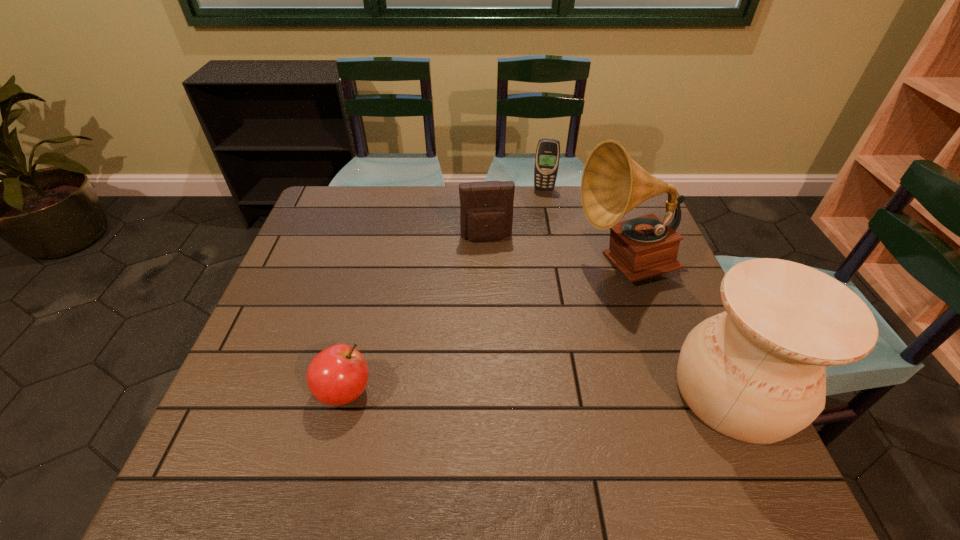
This screenshot has height=540, width=960. Identify the location of vacant space located with an open flap on the second object from left to right. (503, 332).

What are the coordinates of `vacant space situated on the horn of the phonograph record` in the screenshot? It's located at (562, 313).

This screenshot has height=540, width=960. In order to click on vacant space located on the horn of the phonograph record in this screenshot , I will do `click(528, 343)`.

This screenshot has width=960, height=540. I want to click on vacant space located on the horn of the phonograph record, so click(571, 305).

In order to click on vacant space located 0.260m on the screen of the cellular telephone in this screenshot , I will do `click(536, 240)`.

This screenshot has height=540, width=960. In order to click on vacant space located 0.210m on the screen of the cellular telephone in this screenshot , I will do `click(538, 230)`.

This screenshot has height=540, width=960. Find the location of `vacant space located 0.290m on the screen of the cellular telephone`. vacant space located 0.290m on the screen of the cellular telephone is located at coordinates (x=535, y=247).

Find the location of a particular element. The image size is (960, 540). object present at the far edge is located at coordinates (547, 157).

Find the location of `apple that is at the near edge`. apple that is at the near edge is located at coordinates (338, 375).

Identify the location of pottery located at the near edge. (756, 373).